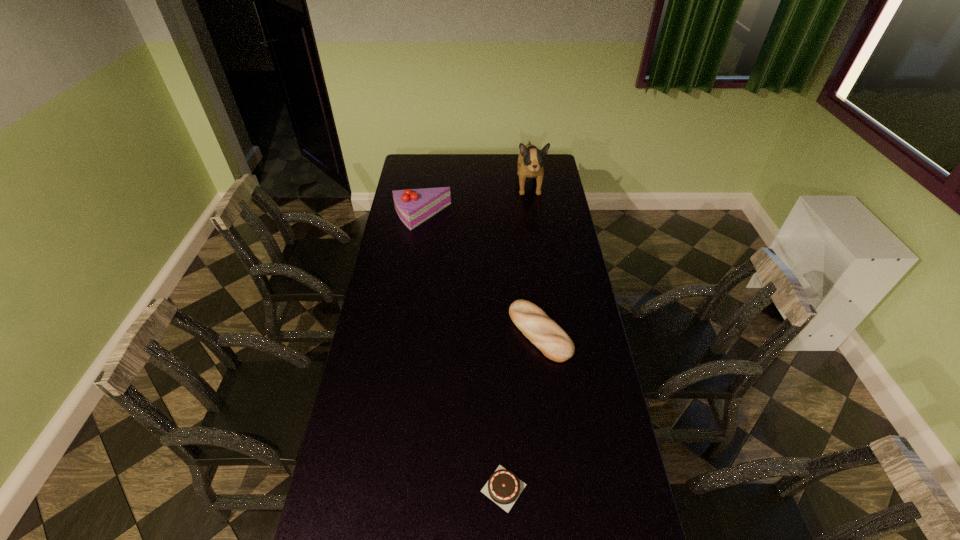
The width and height of the screenshot is (960, 540). Identify the location of vacant space located 0.310m on the front of the bread. (554, 447).

Identify the location of vacant space located on the back of the shortest object. (499, 368).

Find the location of a particular element. The width and height of the screenshot is (960, 540). object located in the far edge section of the desktop is located at coordinates (530, 161).

Where is `object positioned at the left edge`? object positioned at the left edge is located at coordinates (414, 206).

You are a GUI agent. You are given a task and a screenshot of the screen. Output one action in this format:
    pyautogui.click(x=<x>, y=<y>)
    Task: Click on the puppy at the right edge
    Image resolution: width=960 pixels, height=540 pixels.
    Given the screenshot: What is the action you would take?
    pyautogui.click(x=530, y=161)

Locate an element on the screen. bread that is at the right edge is located at coordinates (542, 331).

Where is `object located in the far right corner section of the desktop`? The image size is (960, 540). object located in the far right corner section of the desktop is located at coordinates (x=530, y=161).

Find the location of a particular element. Image resolution: width=960 pixels, height=540 pixels. free point at the far edge is located at coordinates coord(507,168).

At what (x,y) coordinates should I click in order to perform the action: click on free location at the left edge of the desktop. Please return your answer as a coordinate pair (x, y). Looking at the image, I should click on (353, 453).

Where is `vacant point at the right edge`? Image resolution: width=960 pixels, height=540 pixels. vacant point at the right edge is located at coordinates (573, 356).